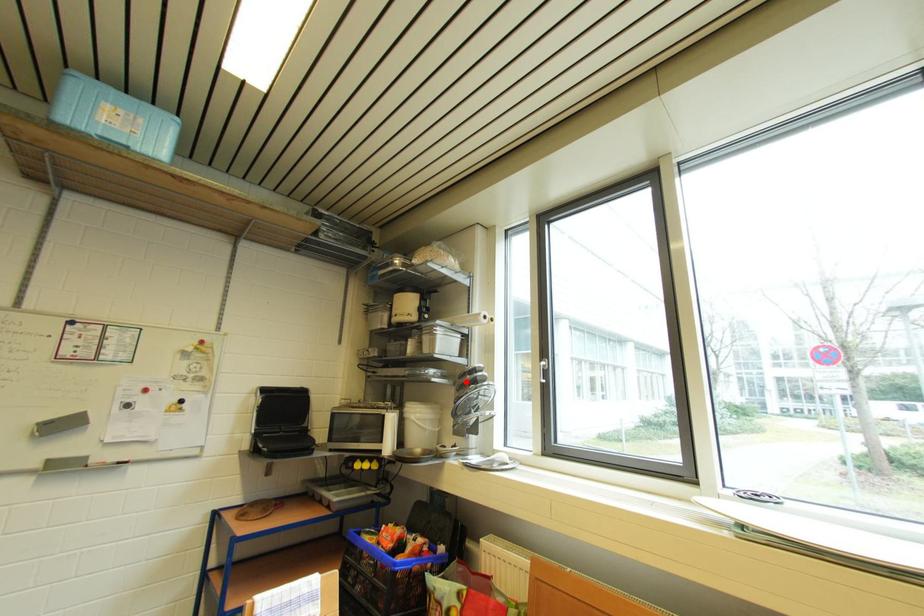
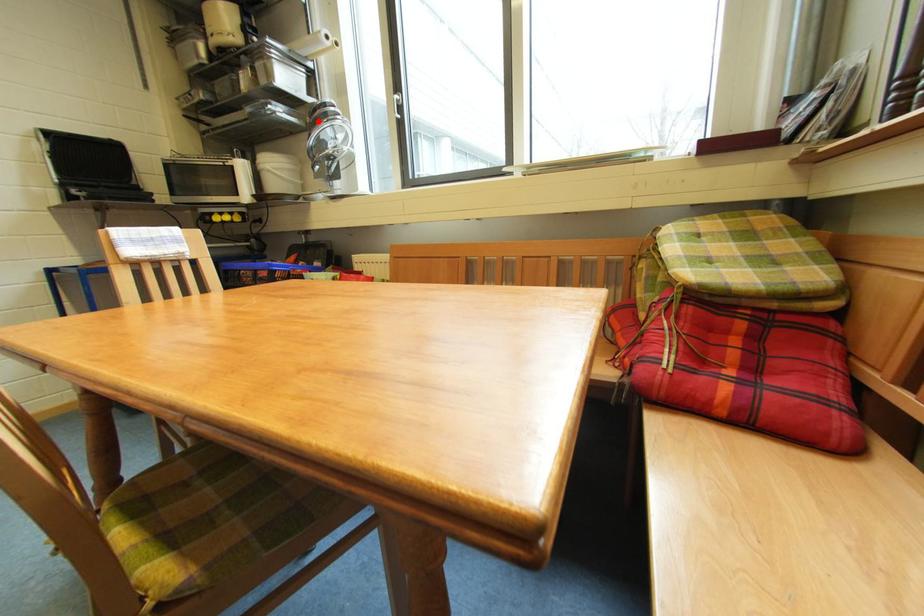
I am providing you with two images of the same scene from different viewpoints. A red point is marked on the first image and another point is marked on the second image. Are the points marked in image1 and image2 representing the same 3D position?

Yes